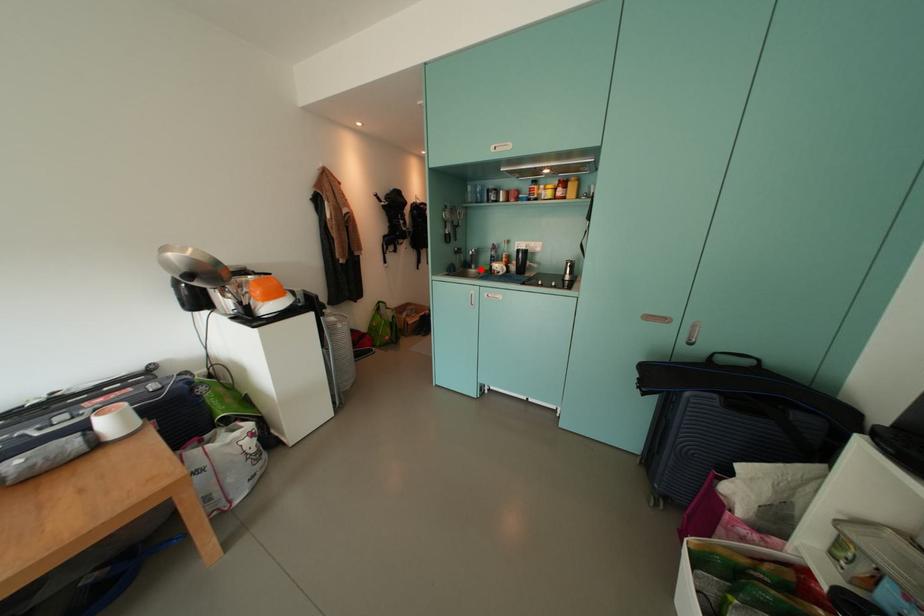
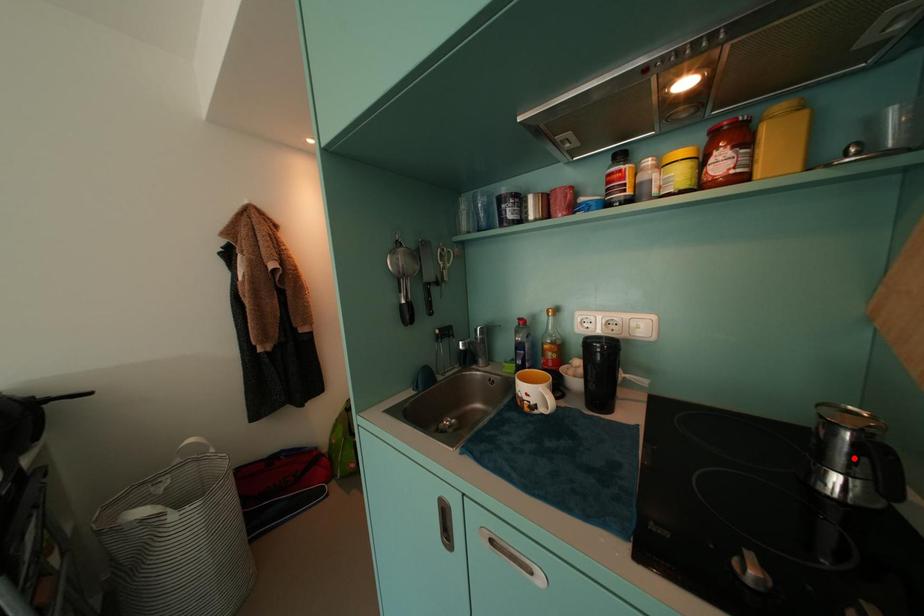
I am providing you with two images of the same scene from different viewpoints. A red point is marked on the first image and another point is marked on the second image. Does the point marked in image1 correspond to the same location as the one in image2?

No